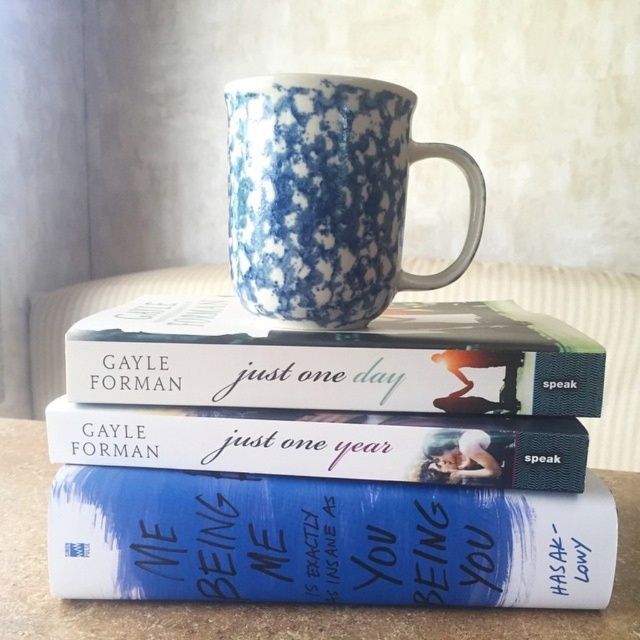
Question: Considering the relative positions of speckled ceramic mug at center and blue textured book at center in the image provided, where is speckled ceramic mug at center located with respect to blue textured book at center?

Choices:
 (A) left
 (B) right

Answer: (B)

Question: Among these objects, which one is farthest from the camera?

Choices:
 (A) white matte book at center
 (B) blue textured book at center
 (C) speckled ceramic mug at center
 (D) matte hardcover book at center

Answer: (C)

Question: Is matte hardcover book at center further to camera compared to blue textured book at center?

Choices:
 (A) yes
 (B) no

Answer: (A)

Question: Among these points, which one is farthest from the camera?

Choices:
 (A) (493, 460)
 (B) (300, 212)

Answer: (B)

Question: Is white matte book at center to the left of blue textured book at center from the viewer's perspective?

Choices:
 (A) yes
 (B) no

Answer: (B)

Question: Which object appears farthest from the camera in this image?

Choices:
 (A) white matte book at center
 (B) matte hardcover book at center
 (C) blue textured book at center

Answer: (A)